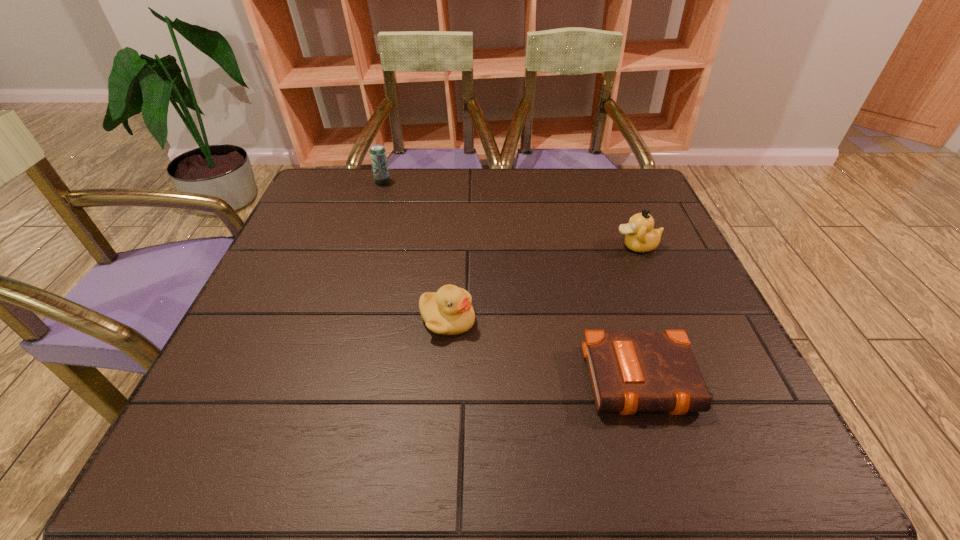
Find the location of `free space that is in between the leftmost object and the shortest object`. free space that is in between the leftmost object and the shortest object is located at coordinates (514, 282).

Find the location of a particular element. The width and height of the screenshot is (960, 540). vacant space in between the farthest object and the left duckling is located at coordinates (415, 252).

I want to click on vacant point located between the farthest object and the nearer duckling, so click(x=415, y=252).

Locate an element on the screen. The height and width of the screenshot is (540, 960). free area in between the third nearest object and the leftmost object is located at coordinates (510, 214).

I want to click on vacant space that's between the farther duckling and the shortest object, so click(640, 313).

At what (x,y) coordinates should I click in order to perform the action: click on unoccupied area between the shortest object and the third farthest object. Please return your answer as a coordinate pair (x, y). This screenshot has height=540, width=960. Looking at the image, I should click on (546, 350).

The width and height of the screenshot is (960, 540). In order to click on the second closest object to the nearer duckling in this screenshot , I will do `click(640, 236)`.

Choose which object is the third nearest neighbor to the second farthest object. Please provide its 2D coordinates. Your answer should be formatted as a tuple, i.e. [(x, y)], where the tuple contains the x and y coordinates of a point satisfying the conditions above.

[(378, 157)]

Where is `vacant space that satisfies the following two spatial constraints: 1. on the face of the second farthest object; 2. on the spine side of the Bible`? The image size is (960, 540). vacant space that satisfies the following two spatial constraints: 1. on the face of the second farthest object; 2. on the spine side of the Bible is located at coordinates (x=691, y=381).

Where is `free space in the image that satisfies the following two spatial constraints: 1. on the face of the right duckling; 2. on the spine side of the Bible`? free space in the image that satisfies the following two spatial constraints: 1. on the face of the right duckling; 2. on the spine side of the Bible is located at coordinates (691, 381).